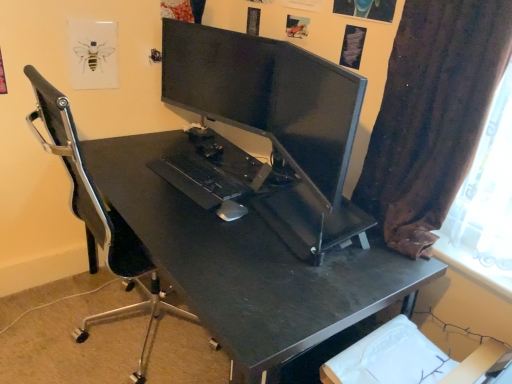
Identify the location of free location above black matte desk at center (from a real-world perspective). (216, 195).